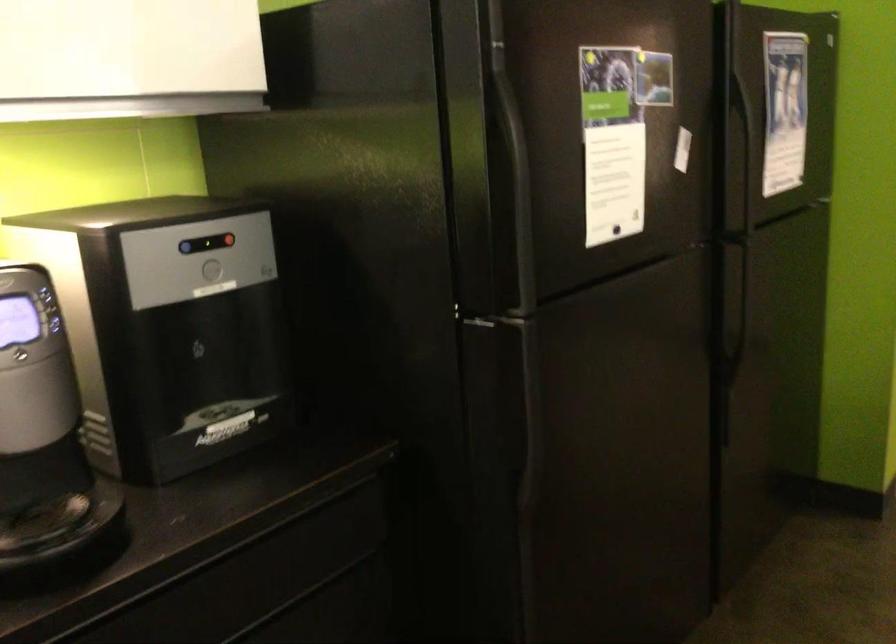
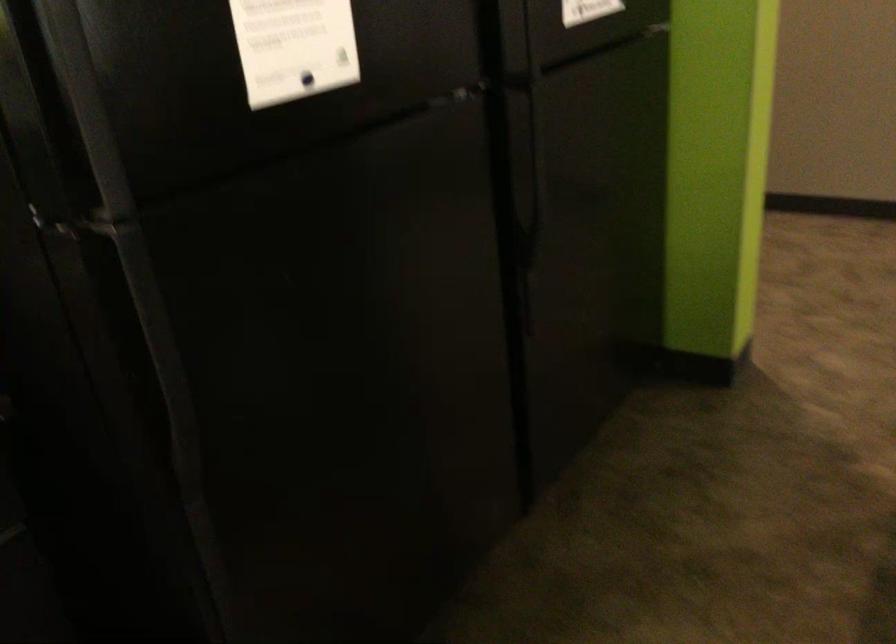
Question: The first image is from the beginning of the video and the second image is from the end. How did the camera likely rotate when shooting the video?

Choices:
 (A) Left
 (B) Right
 (C) Up
 (D) Down

Answer: (D)